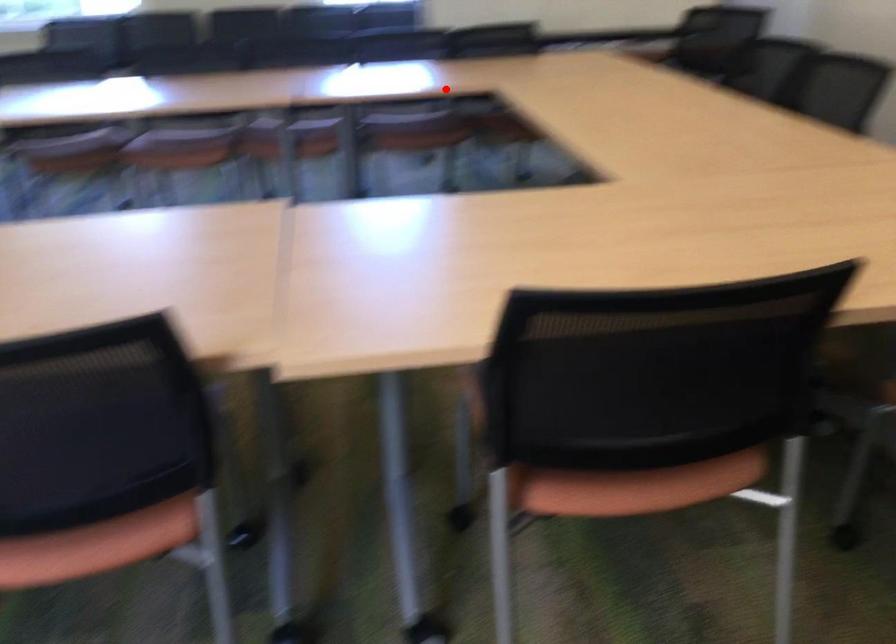
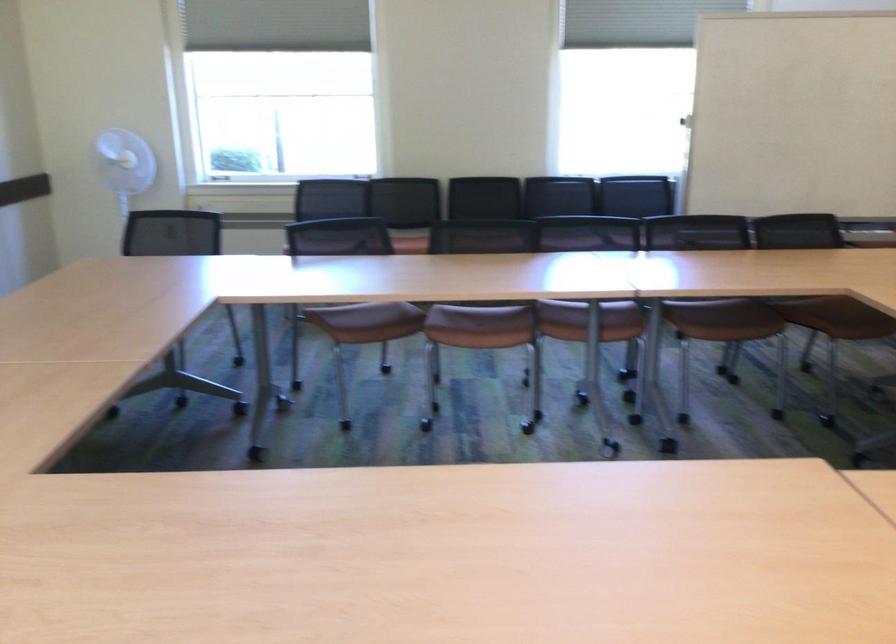
Where in the second image is the point corresponding to the highlighted location from the first image?

(820, 295)